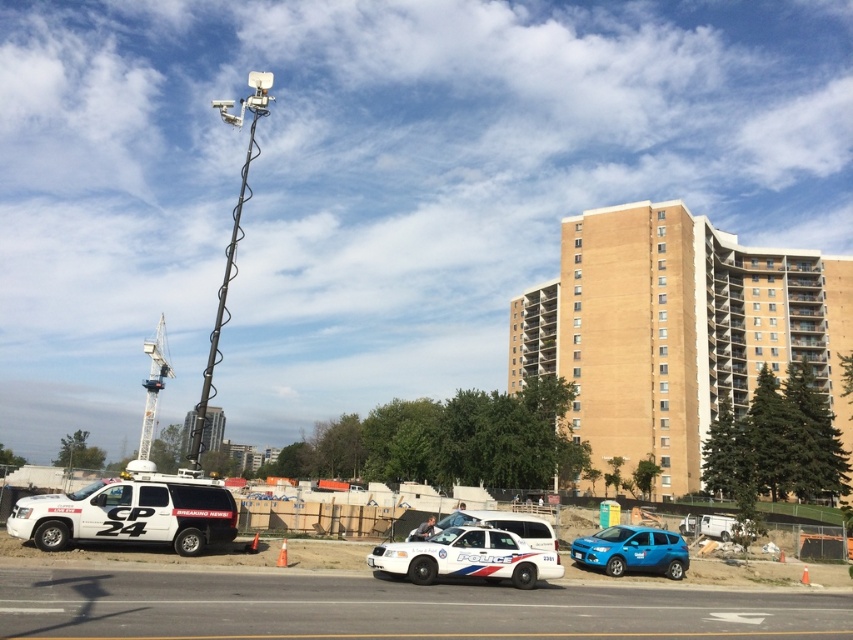
Question: Considering the real-world distances, which object is farthest from the white matte van at center?

Choices:
 (A) white glossy police car at center
 (B) white metallic crane at upper left

Answer: (B)

Question: Which object appears farthest from the camera in this image?

Choices:
 (A) white glossy police car at center
 (B) white metallic crane at upper left
 (C) matte blue hatchback at lower right
 (D) white matte van at center

Answer: (B)

Question: Is white matte van at center thinner than matte blue hatchback at lower right?

Choices:
 (A) yes
 (B) no

Answer: (B)

Question: Where is matte blue hatchback at lower right located in relation to white metallic crane at upper left in the image?

Choices:
 (A) below
 (B) above

Answer: (B)

Question: Where is white matte van at center located in relation to matte blue hatchback at lower right in the image?

Choices:
 (A) above
 (B) below

Answer: (A)

Question: Among these points, which one is nearest to the camera?

Choices:
 (A) (173, 376)
 (B) (621, 536)
 (C) (120, 520)
 (D) (418, 566)

Answer: (D)